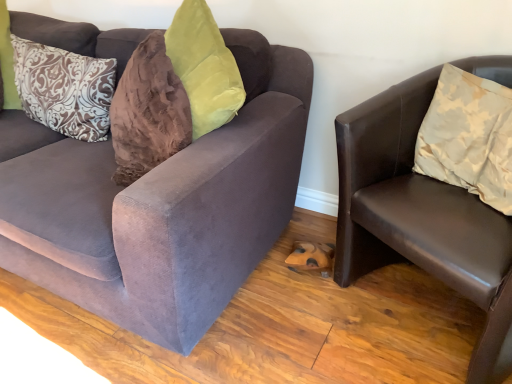
At what (x,y) coordinates should I click in order to perform the action: click on vacant area situated below brown leather chair at right, the first studio couch viewed from the right (from a real-world perspective). Please return your answer as a coordinate pair (x, y). The image size is (512, 384). Looking at the image, I should click on (418, 310).